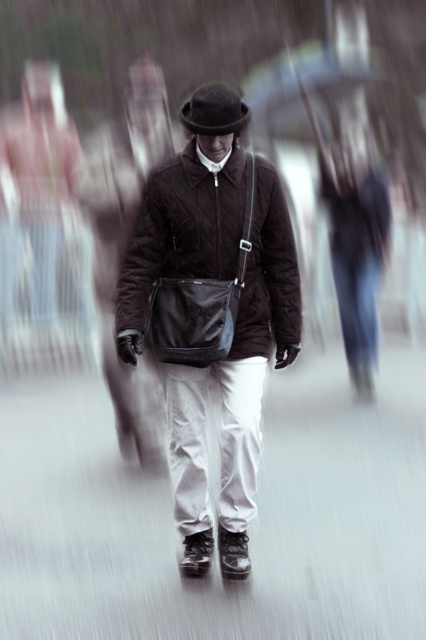
Who is lower down, white smooth pavement at center or black felt fedora at center?

white smooth pavement at center is below.

Is point (141, 563) positioned in front of point (189, 106)?

No, it is behind (189, 106).

The image size is (426, 640). What are the coordinates of `white smooth pavement at center` in the screenshot? It's located at (250, 531).

Is matte black bag at center above black felt fedora at center?

No.

Who is more distant from viewer, (230, 168) or (238, 132)?

Point (230, 168)

Image resolution: width=426 pixels, height=640 pixels. Describe the element at coordinates (212, 324) in the screenshot. I see `matte black bag at center` at that location.

You are a GUI agent. You are given a task and a screenshot of the screen. Output one action in this format:
    pyautogui.click(x=<x>, y=<y>)
    Task: Click on the matte black bag at center
    
    Given the screenshot: What is the action you would take?
    pyautogui.click(x=212, y=324)

Which is below, white smooth pavement at center or matte black bag at center?

white smooth pavement at center is lower down.

At what (x,y) coordinates should I click in order to perform the action: click on white smooth pavement at center. Please return your answer as a coordinate pair (x, y). Image resolution: width=426 pixels, height=640 pixels. Looking at the image, I should click on (250, 531).